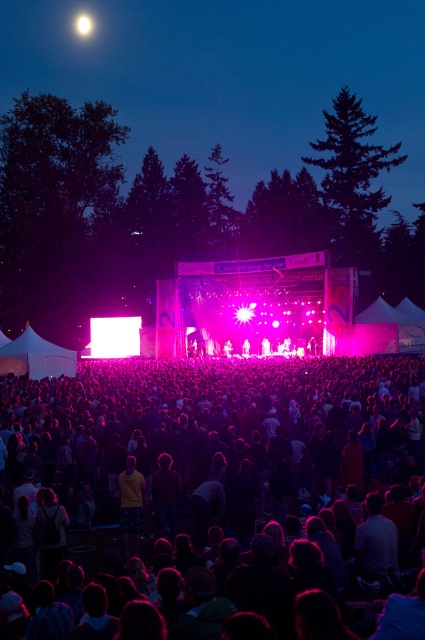
Question: Can you confirm if black fabric crowd at center is smaller than yellow cotton shirt at center?

Choices:
 (A) no
 (B) yes

Answer: (A)

Question: Which object appears closest to the camera in this image?

Choices:
 (A) black fabric crowd at center
 (B) yellow cotton shirt at center

Answer: (A)

Question: Which object appears farthest from the camera in this image?

Choices:
 (A) yellow cotton shirt at center
 (B) black fabric crowd at center

Answer: (A)

Question: Is black fabric crowd at center to the right of yellow cotton shirt at center from the viewer's perspective?

Choices:
 (A) no
 (B) yes

Answer: (B)

Question: Can you confirm if black fabric crowd at center is wider than yellow cotton shirt at center?

Choices:
 (A) yes
 (B) no

Answer: (A)

Question: Which object appears farthest from the camera in this image?

Choices:
 (A) yellow cotton shirt at center
 (B) black fabric crowd at center

Answer: (A)